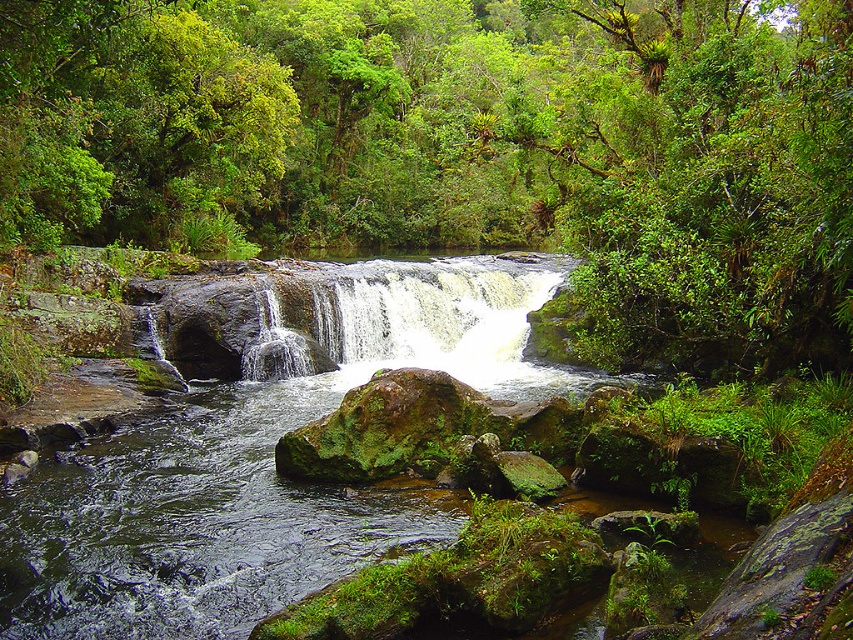
Is the position of green leafy tree at upper center less distant than that of white frothy water at center?

Yes.

Consider the image. Can you confirm if green leafy tree at upper center is positioned above white frothy water at center?

Yes, green leafy tree at upper center is above white frothy water at center.

Locate an element on the screen. This screenshot has height=640, width=853. green leafy tree at upper center is located at coordinates (712, 182).

Between green leafy tree at center and green leafy tree at upper center, which one is positioned lower?

green leafy tree at upper center is lower down.

Is point (351, 152) positioned in front of point (825, 360)?

No, it is not.

The image size is (853, 640). Find the location of `green leafy tree at center`. green leafy tree at center is located at coordinates (463, 145).

Is green leafy tree at center shorter than white frothy water at center?

No, green leafy tree at center is not shorter than white frothy water at center.

What do you see at coordinates (463, 145) in the screenshot? This screenshot has width=853, height=640. I see `green leafy tree at center` at bounding box center [463, 145].

The image size is (853, 640). In order to click on green leafy tree at center in this screenshot , I will do `click(463, 145)`.